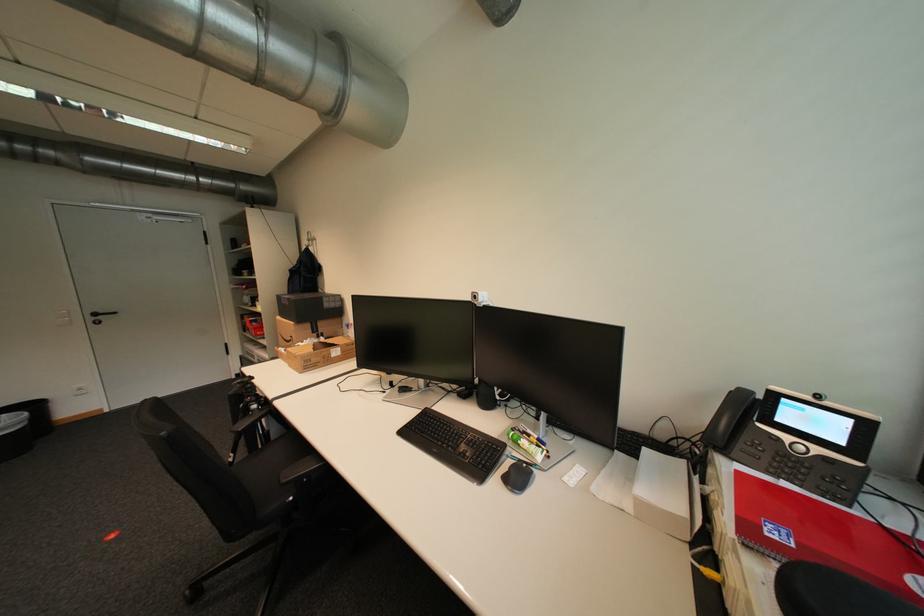
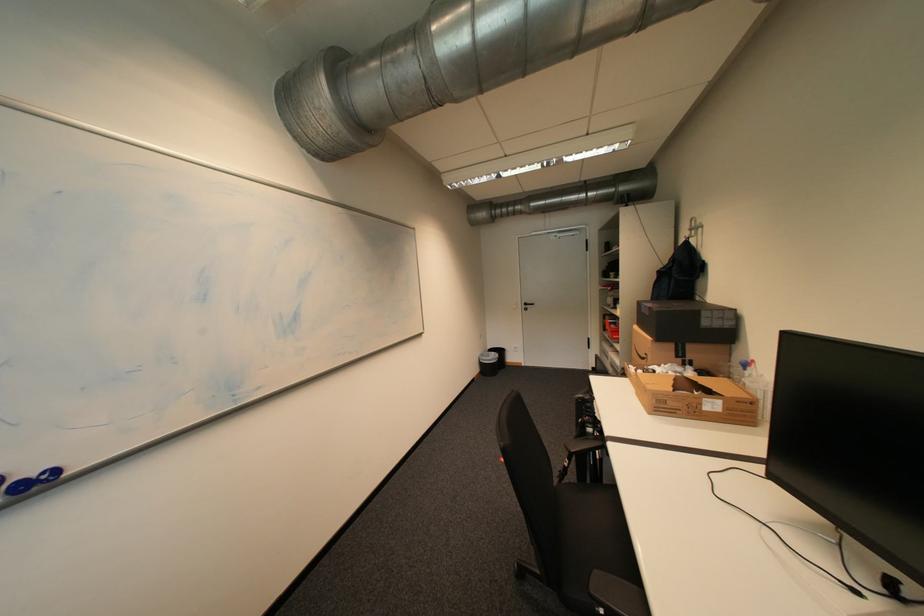
Question: The camera is either moving clockwise (left) or counter-clockwise (right) around the object. The first image is from the beginning of the video and the second image is from the end. Is the camera moving left or right when shooting the video?

Choices:
 (A) Left
 (B) Right

Answer: (B)